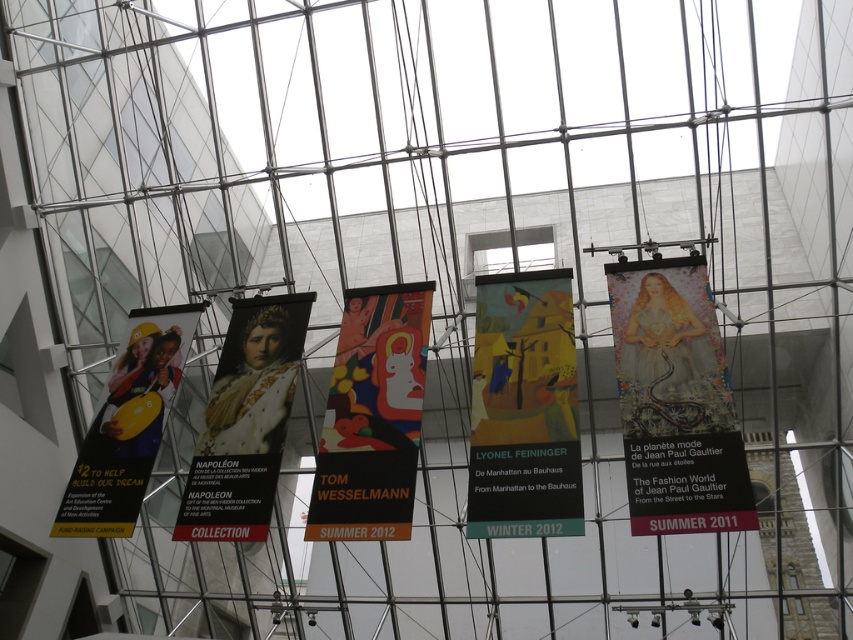
You are standing in the gallery and want to take a photo of both the matte yellow banner at center and the multicolored fabric banner at center. The camera you have can capture objects up to 12 feet apart in a single frame. Can you capture both banners in one photo without moving?

The matte yellow banner at center is 10.94 feet away from the multicolored fabric banner at center. Since the distance between them is less than 12 feet, you can capture both banners in one photo without moving.